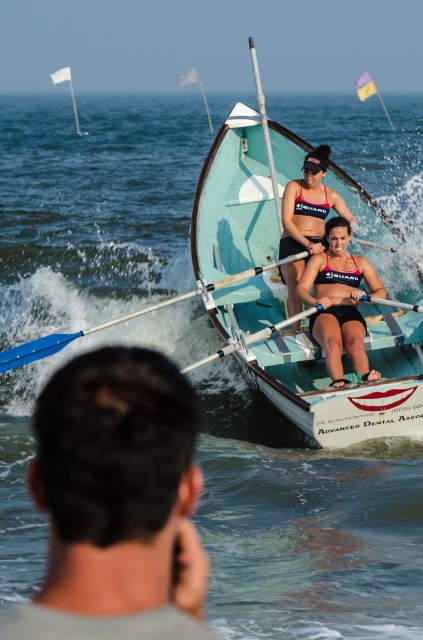
In the image of the rowing scene, there is a point labeled as point A at coordinates (117, 502). Based on the scene description, what object or feature does this point most likely correspond to?

The point labeled as point A at coordinates (117, 502) corresponds to the dark brown hair at lower left.

What is the exact coordinate of the dark brown hair at lower left?

The dark brown hair at lower left is located at point (x=117, y=502).